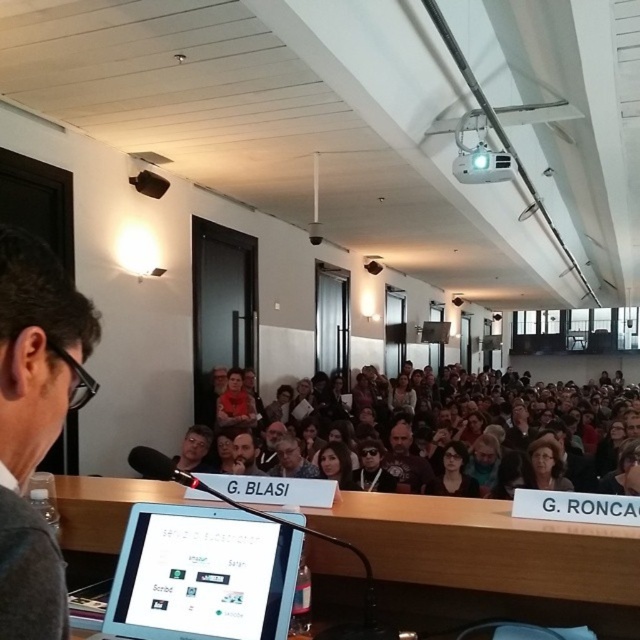
You are an event planner who needs to place a small microphone stand between the matte black glasses at center and the matte black hair at center. The stand requires a minimum of 24 inches of space. Can the stand be placed there?

The distance between the matte black glasses at center and the matte black hair at center is 31.83 inches, which is more than the required 24 inches. Therefore, the microphone stand can be placed between them with sufficient space.

You are an attendee at the conference and want to discreetly point out the speaker wearing the matte black glasses at center to a colleague without mentioning their name. Which direction should you indicate relative to the blue scarf at center?

The matte black glasses at center is to the left of the blue scarf at center, so you should indicate the direction to the left of the blue scarf at center.